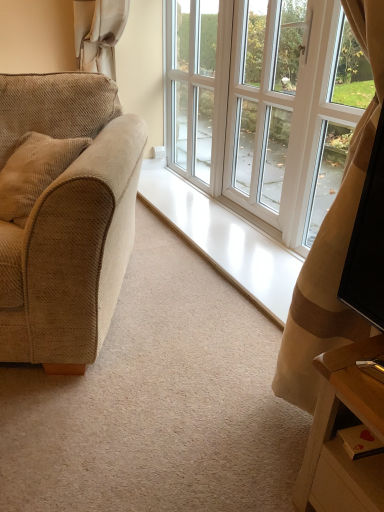
Question: Considering the relative sizes of beige corduroy couch at left and white glossy screen door at center, acting as the 1th screen door starting from the right, in the image provided, is beige corduroy couch at left taller than white glossy screen door at center, acting as the 1th screen door starting from the right,?

Choices:
 (A) no
 (B) yes

Answer: (A)

Question: Considering the relative sizes of beige corduroy couch at left and white glossy screen door at center, which is the 2th screen door from left to right, in the image provided, is beige corduroy couch at left bigger than white glossy screen door at center, which is the 2th screen door from left to right,?

Choices:
 (A) no
 (B) yes

Answer: (B)

Question: From the image's perspective, does beige corduroy couch at left appear lower than white glossy screen door at center, which is the 2th screen door from left to right?

Choices:
 (A) yes
 (B) no

Answer: (A)

Question: Is beige corduroy couch at left far away from white glossy screen door at center, acting as the 1th screen door starting from the right?

Choices:
 (A) yes
 (B) no

Answer: (A)

Question: Does beige corduroy couch at left have a lesser width compared to white glossy screen door at center, acting as the 1th screen door starting from the right?

Choices:
 (A) yes
 (B) no

Answer: (B)

Question: Is white glossy screen door at center, acting as the 1th screen door starting from the right, surrounded by beige corduroy couch at left?

Choices:
 (A) no
 (B) yes

Answer: (A)

Question: Considering the relative positions of white glass window at center and beige corduroy couch at left in the image provided, is white glass window at center in front of beige corduroy couch at left?

Choices:
 (A) yes
 (B) no

Answer: (A)

Question: Considering the relative sizes of white glass window at center and beige corduroy couch at left in the image provided, is white glass window at center shorter than beige corduroy couch at left?

Choices:
 (A) no
 (B) yes

Answer: (A)

Question: From a real-world perspective, is white glass window at center physically below beige corduroy couch at left?

Choices:
 (A) no
 (B) yes

Answer: (A)

Question: Is white glass window at center turned away from beige corduroy couch at left?

Choices:
 (A) no
 (B) yes

Answer: (A)

Question: Is white glass window at center oriented towards beige corduroy couch at left?

Choices:
 (A) no
 (B) yes

Answer: (B)

Question: From the image's perspective, is white glass window at center over beige corduroy couch at left?

Choices:
 (A) no
 (B) yes

Answer: (A)

Question: Is white glass screen door at upper center, the first screen door in the left-to-right sequence, not close to white glass window at center?

Choices:
 (A) yes
 (B) no

Answer: (B)